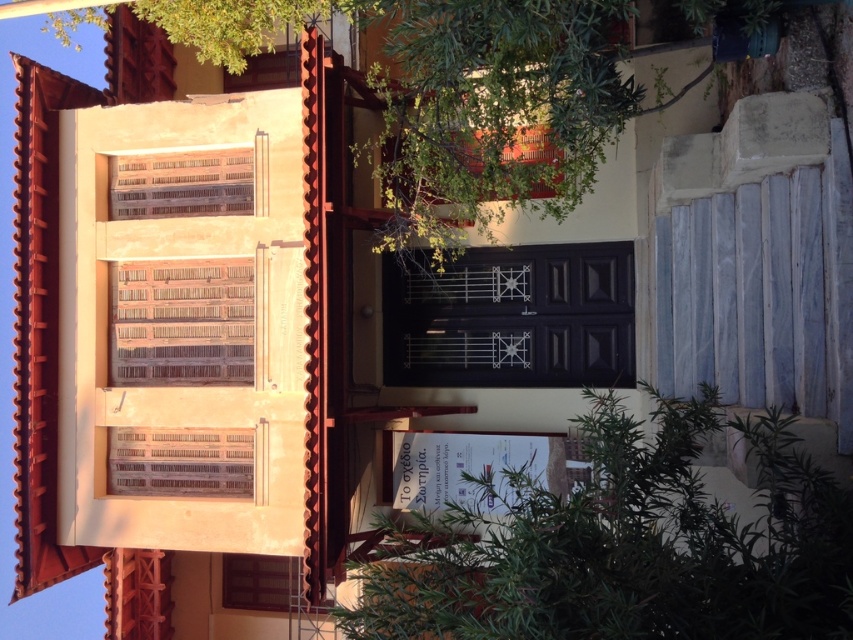
Is point (468, 513) positioned before point (112, 300)?

Yes, point (468, 513) is closer to viewer.

Does point (370, 588) come behind point (125, 307)?

No, (370, 588) is closer to viewer.

I want to click on green leafy plant at center, so click(627, 547).

Can you confirm if green leafy plant at center is positioned above wooden slats at upper left?

No.

Does point (561, 531) come farther from viewer compared to point (140, 200)?

No, (561, 531) is in front of (140, 200).

The height and width of the screenshot is (640, 853). I want to click on green leafy plant at center, so click(627, 547).

Based on the photo, can you confirm if black matte door at center is positioned to the left of wooden slats at center?

No, black matte door at center is not to the left of wooden slats at center.

Based on the photo, who is more forward, (630, 356) or (167, 369)?

Positioned in front is point (167, 369).

Does point (506, 282) come behind point (126, 280)?

Yes.

Where is `black matte door at center`? The width and height of the screenshot is (853, 640). black matte door at center is located at coordinates (509, 316).